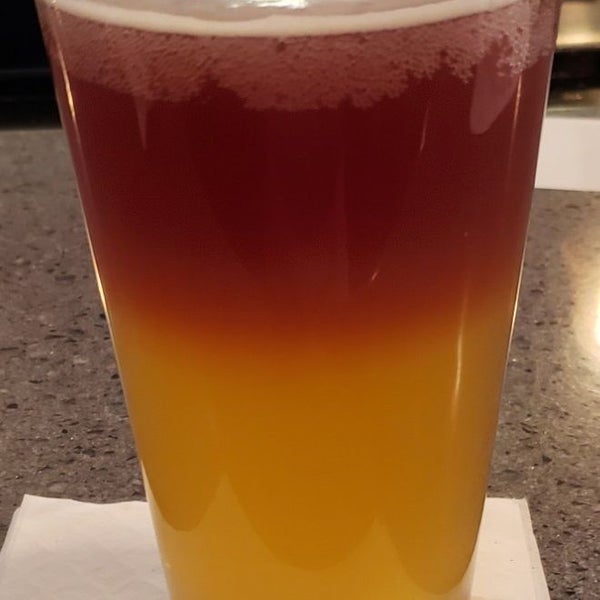
Locate an element on the screen. light gray marble surface with black small shapes is located at coordinates (537, 383).